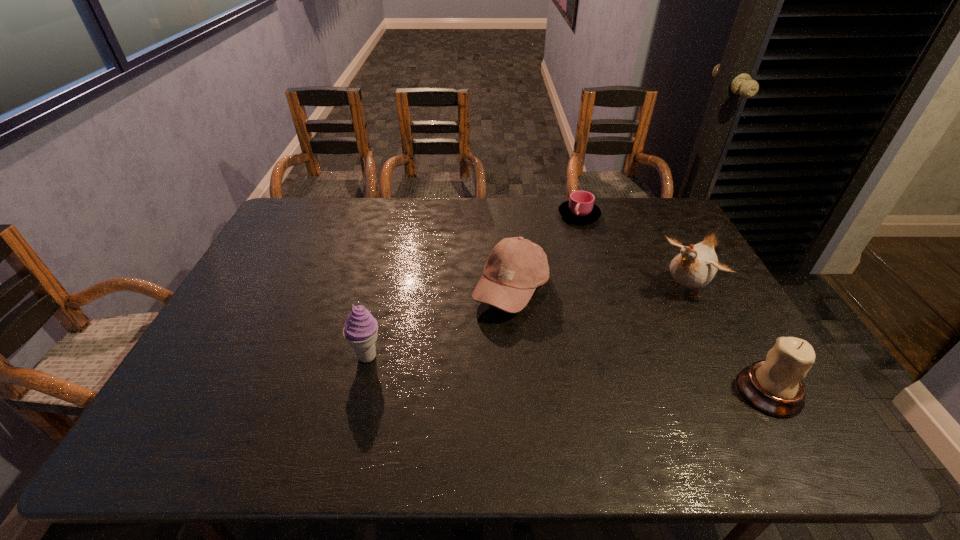
The width and height of the screenshot is (960, 540). What are the coordinates of `empty space between the bird and the leftmost object` in the screenshot? It's located at (527, 321).

Where is `vacant area that lies between the fourth object from right to left and the cup`? The width and height of the screenshot is (960, 540). vacant area that lies between the fourth object from right to left and the cup is located at coordinates (545, 252).

Image resolution: width=960 pixels, height=540 pixels. What are the coordinates of `free space between the baseball cap and the cup` in the screenshot? It's located at (545, 252).

Where is `free space between the icecream and the candle holder`? free space between the icecream and the candle holder is located at coordinates (568, 374).

The image size is (960, 540). I want to click on unoccupied position between the candle holder and the bird, so click(x=728, y=339).

Image resolution: width=960 pixels, height=540 pixels. I want to click on free space between the candle holder and the icecream, so click(x=568, y=374).

Locate an element on the screen. The height and width of the screenshot is (540, 960). vacant area that lies between the bird and the icecream is located at coordinates (527, 321).

Identify the location of empty space that is in between the bird and the farthest object. (633, 251).

Locate which object is the fourth closest to the leftmost object. Please provide its 2D coordinates. Your answer should be formatted as a tuple, i.e. [(x, y)], where the tuple contains the x and y coordinates of a point satisfying the conditions above.

[(774, 386)]

The width and height of the screenshot is (960, 540). Find the location of `object that is the second nearest to the icecream`. object that is the second nearest to the icecream is located at coordinates (580, 208).